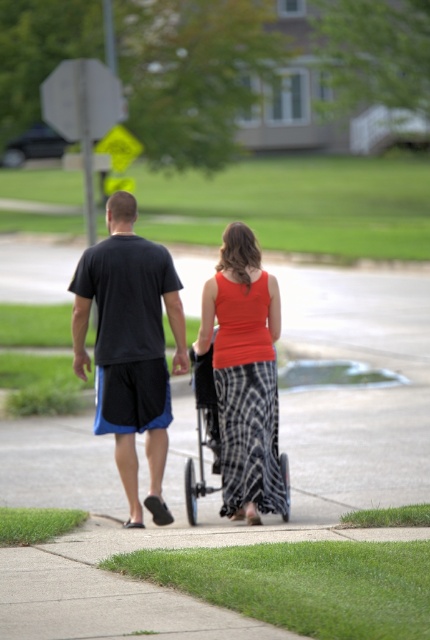
Question: Among these objects, which one is farthest from the camera?

Choices:
 (A) orange sleeveless top at center
 (B) black fabric shorts at center

Answer: (B)

Question: Which point is farther from the camera taking this photo?

Choices:
 (A) (273, 422)
 (B) (150, 346)

Answer: (B)

Question: Does black fabric shorts at center lie behind orange sleeveless top at center?

Choices:
 (A) yes
 (B) no

Answer: (A)

Question: Does black fabric shorts at center have a larger size compared to orange sleeveless top at center?

Choices:
 (A) no
 (B) yes

Answer: (B)

Question: Does black fabric shorts at center appear on the left side of orange sleeveless top at center?

Choices:
 (A) yes
 (B) no

Answer: (A)

Question: Which of the following is the farthest from the observer?

Choices:
 (A) black fabric shorts at center
 (B) orange sleeveless top at center

Answer: (A)